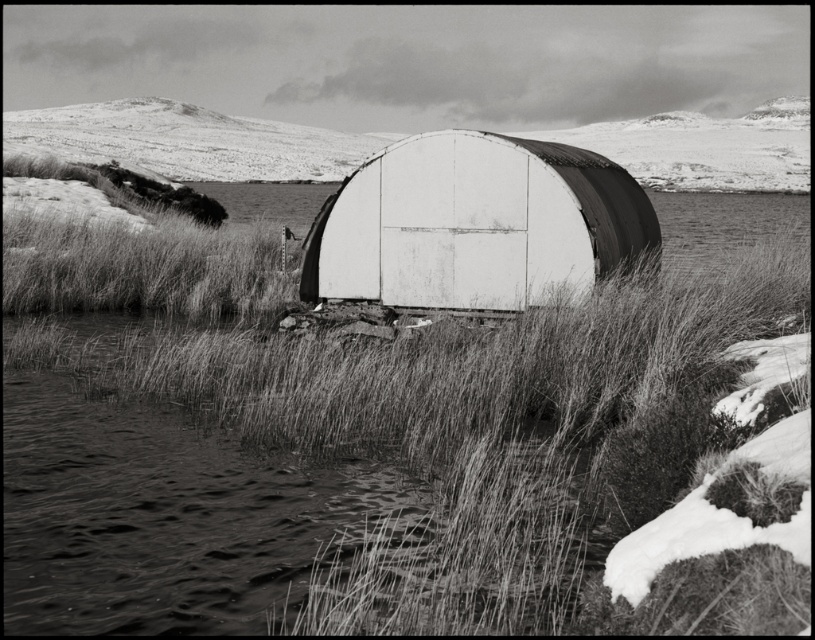
You are standing at the edge of the water in the lower left of the image. The point marked by coordinates (153, 516) is labeled as fuzzy grass at center. Which direction should you walk to reach the fuzzy grass at center from your current position?

You should walk northeast from your current position at the edge of the water in the lower left to reach the fuzzy grass at center marked by the point (153, 516).

You are a photographer planning to capture the white corrugated metal hut at center and the smooth white dome at center in a single shot. Based on the scene, can you determine which object is closer to the camera?

The white corrugated metal hut at center is positioned under the smooth white dome at center, meaning the hut is closer to the camera than the dome.